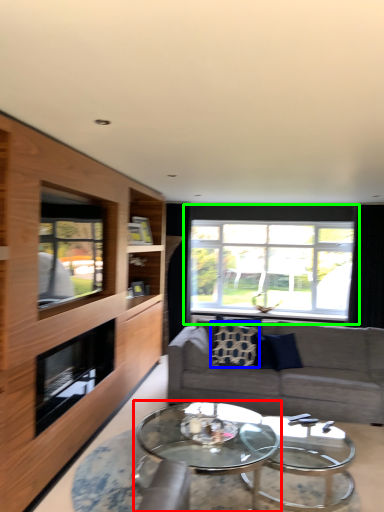
Question: Estimate the real-world distances between objects in this image. Which object is closer to coffee table (highlighted by a red box), pillow (highlighted by a blue box) or window (highlighted by a green box)?

Choices:
 (A) pillow
 (B) window

Answer: (A)